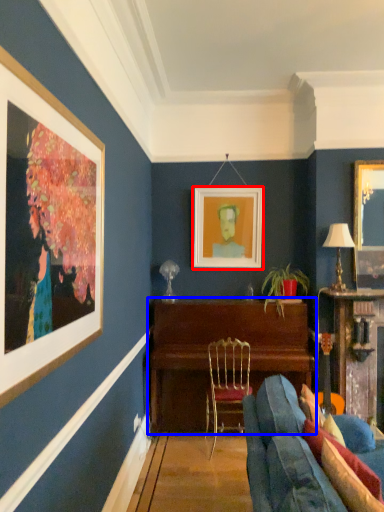
Question: Which point is closer to the camera, picture frame (highlighted by a red box) or table (highlighted by a blue box)?

Choices:
 (A) picture frame
 (B) table

Answer: (B)